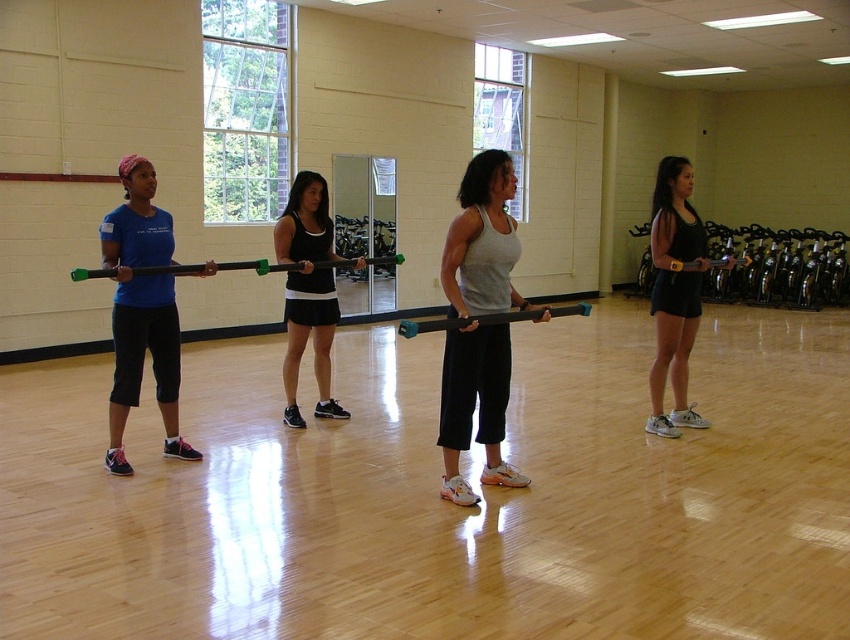
Between point (673, 276) and point (279, 234), which one is positioned behind?

The point (279, 234) is more distant.

Can you confirm if black matte shorts at right is shorter than black matte tank top at center?

No.

Between point (680, 176) and point (333, 417), which one is positioned behind?

The point (333, 417) is behind.

Find the location of a particular element. black matte shorts at right is located at coordinates (673, 292).

Can you confirm if gray matte tank top at center is taller than black matte shorts at right?

In fact, gray matte tank top at center may be shorter than black matte shorts at right.

Who is more forward, (x=485, y=470) or (x=673, y=232)?

Point (x=485, y=470) is more forward.

Describe the element at coordinates (474, 406) in the screenshot. I see `gray matte tank top at center` at that location.

This screenshot has height=640, width=850. Identify the location of gray matte tank top at center. (474, 406).

Is gray matte tank top at center closer to the viewer compared to matte blue shirt at left?

Yes.

Is point (536, 320) closer to viewer compared to point (115, 417)?

Yes.

In order to click on gray matte tank top at center in this screenshot , I will do point(474,406).